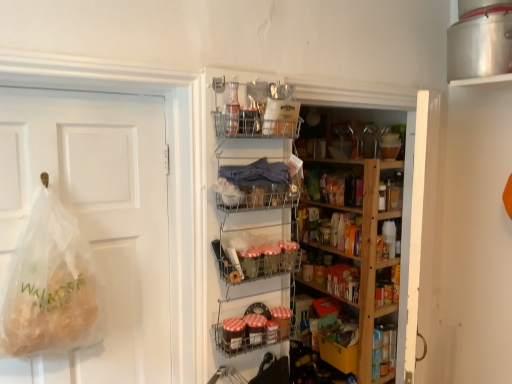
Question: Does metallic wire basket at center, which is counted as the third shelf, starting from the bottom, have a smaller size compared to wooden shelves at center, the second shelf in the bottom-to-top sequence?

Choices:
 (A) yes
 (B) no

Answer: (A)

Question: From a real-world perspective, is metallic wire basket at center, the third shelf viewed from the top, located higher than wooden shelves at center, the fourth shelf in the top-to-bottom sequence?

Choices:
 (A) yes
 (B) no

Answer: (A)

Question: Is metallic wire basket at center, the third shelf viewed from the top, facing towards wooden shelves at center, the second shelf in the bottom-to-top sequence?

Choices:
 (A) yes
 (B) no

Answer: (B)

Question: Does metallic wire basket at center, which is counted as the third shelf, starting from the bottom, appear on the right side of wooden shelves at center, the second shelf in the bottom-to-top sequence?

Choices:
 (A) yes
 (B) no

Answer: (B)

Question: Is metallic wire basket at center, the third shelf viewed from the top, bigger than wooden shelves at center, the fourth shelf in the top-to-bottom sequence?

Choices:
 (A) yes
 (B) no

Answer: (B)

Question: Considering the relative positions of metallic wire basket at center, which is counted as the third shelf, starting from the bottom, and metallic wire baskets at lower center, which is counted as the 5th shelf, starting from the top, in the image provided, is metallic wire basket at center, which is counted as the third shelf, starting from the bottom, to the left or to the right of metallic wire baskets at lower center, which is counted as the 5th shelf, starting from the top,?

Choices:
 (A) left
 (B) right

Answer: (B)

Question: From a real-world perspective, is metallic wire basket at center, the third shelf viewed from the top, positioned above or below metallic wire baskets at lower center, which is counted as the 5th shelf, starting from the top?

Choices:
 (A) above
 (B) below

Answer: (A)

Question: From the image's perspective, is metallic wire basket at center, which is counted as the third shelf, starting from the bottom, located above or below metallic wire baskets at lower center, positioned as the first shelf in bottom-to-top order?

Choices:
 (A) above
 (B) below

Answer: (A)

Question: From their relative heights in the image, would you say metallic wire basket at center, which is counted as the third shelf, starting from the bottom, is taller or shorter than metallic wire baskets at lower center, which is counted as the 5th shelf, starting from the top?

Choices:
 (A) tall
 (B) short

Answer: (B)

Question: Is clear plastic bag at left bigger or smaller than metallic wire basket at center, acting as the 4th shelf starting from the bottom?

Choices:
 (A) small
 (B) big

Answer: (B)

Question: From a real-world perspective, relative to metallic wire basket at center, which is the 2th shelf in top-to-bottom order, is clear plastic bag at left vertically above or below?

Choices:
 (A) above
 (B) below

Answer: (B)

Question: From the image's perspective, is clear plastic bag at left located above or below metallic wire basket at center, which is the 2th shelf in top-to-bottom order?

Choices:
 (A) above
 (B) below

Answer: (B)

Question: Considering the positions of clear plastic bag at left and metallic wire basket at center, which is the 2th shelf in top-to-bottom order, in the image, is clear plastic bag at left wider or thinner than metallic wire basket at center, which is the 2th shelf in top-to-bottom order,?

Choices:
 (A) wide
 (B) thin

Answer: (B)

Question: From a real-world perspective, is metallic wire basket at upper center, the 1th shelf in the top-to-bottom sequence, above or below translucent plastic bag at left?

Choices:
 (A) above
 (B) below

Answer: (A)

Question: From the image's perspective, relative to translucent plastic bag at left, is metallic wire basket at upper center, the 1th shelf in the top-to-bottom sequence, above or below?

Choices:
 (A) below
 (B) above

Answer: (B)